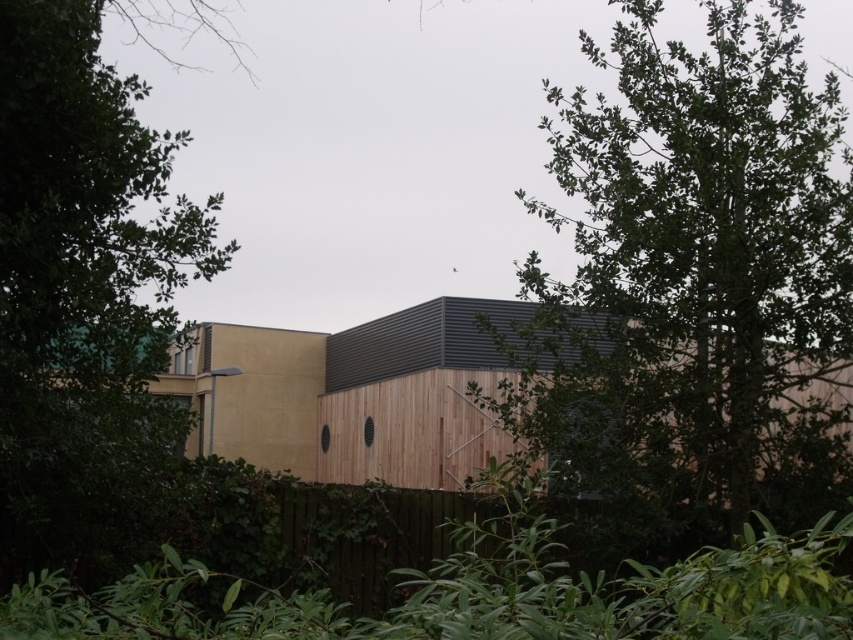
Consider the image. Does green leafy tree at center have a larger size compared to green leafy tree at left?

Yes.

Can you confirm if green leafy tree at center is thinner than green leafy tree at left?

In fact, green leafy tree at center might be wider than green leafy tree at left.

Is point (648, 483) farther from viewer compared to point (164, 154)?

Yes, it is behind point (164, 154).

Identify the location of green leafy tree at center. (695, 280).